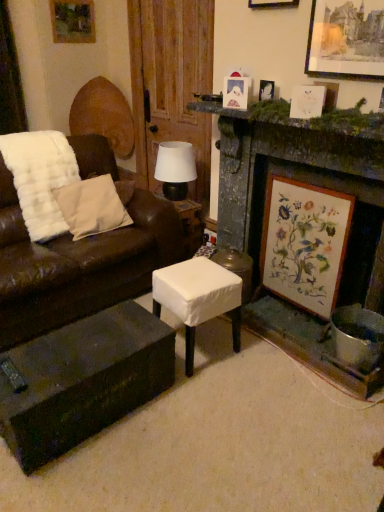
In order to face wooden framed botanical print at right, which is the 6th picture frame from top to bottom, should I rotate leftwards or rightwards?

You should rotate right by 13.926 degrees.

Locate an element on the screen. The height and width of the screenshot is (512, 384). wooden framed botanical print at right, marked as the fifth picture frame in a left-to-right arrangement is located at coordinates (304, 243).

Is white paper picture frame at upper right, which appears as the second picture frame when viewed from the front, not close to wooden picture frame at upper center, the 3th picture frame in the left-to-right sequence?

No, white paper picture frame at upper right, which appears as the second picture frame when viewed from the front, is not far away from wooden picture frame at upper center, the 3th picture frame in the left-to-right sequence.

Consider the image. From a real-world perspective, which object rests below the other?

white paper picture frame at upper right, which appears as the second picture frame when ordered from the bottom.

Is wooden picture frame at upper center, marked as the 4th picture frame in a right-to-left arrangement, completely or partially inside white paper picture frame at upper right, which appears as the second picture frame when viewed from the front?

No.

Could you measure the distance between white paper picture frame at upper right, which appears as the second picture frame when ordered from the bottom, and wooden picture frame at upper center, the 3th picture frame in the left-to-right sequence?

white paper picture frame at upper right, which appears as the second picture frame when ordered from the bottom, is 21.72 inches from wooden picture frame at upper center, the 3th picture frame in the left-to-right sequence.

From a real-world perspective, is wooden framed botanical print at right, which is the 6th picture frame from top to bottom, positioned above or below matte black table lamp at center?

wooden framed botanical print at right, which is the 6th picture frame from top to bottom, is situated lower than matte black table lamp at center in the real world.

Consider the image. Can you confirm if wooden framed botanical print at right, which is the 6th picture frame from top to bottom, is shorter than matte black table lamp at center?

No.

From the matte black table lamp at center, count 2nd picture frames forward and point to it. Please provide its 2D coordinates.

[(304, 243)]

Is matte black table lamp at center bigger or smaller than stone fireplace at center right?

Clearly, matte black table lamp at center is smaller in size than stone fireplace at center right.

Is matte black table lamp at center oriented towards stone fireplace at center right?

Yes, matte black table lamp at center is turned towards stone fireplace at center right.

Between matte black table lamp at center and stone fireplace at center right, which one appears on the left side from the viewer's perspective?

Positioned to the left is matte black table lamp at center.

Do you think white fabric-covered stool at center is within wooden picture frame at upper right, the 3th picture frame from the top, or outside of it?

The correct answer is: outside.

Could you measure the distance between white fabric-covered stool at center and wooden picture frame at upper right, which is the 1th picture frame from front to back?

white fabric-covered stool at center and wooden picture frame at upper right, which is the 1th picture frame from front to back, are 4.35 feet apart from each other.

In the scene shown: What's the angular difference between white fabric-covered stool at center and wooden picture frame at upper right, the 3th picture frame from the top,'s facing directions?

The angular difference between white fabric-covered stool at center and wooden picture frame at upper right, the 3th picture frame from the top, is 4.19 degrees.

Are white fabric-covered stool at center and wooden picture frame at upper right, the 3th picture frame from the top, beside each other?

white fabric-covered stool at center is not next to wooden picture frame at upper right, the 3th picture frame from the top, and they're not touching.

From the picture: Is white fabric-covered stool at center facing towards white paper picture frame at upper right, which is counted as the fifth picture frame, starting from the back?

No, white fabric-covered stool at center is not aimed at white paper picture frame at upper right, which is counted as the fifth picture frame, starting from the back.

How different are the orientations of white fabric-covered stool at center and white paper picture frame at upper right, which is counted as the fifth picture frame, starting from the back, in degrees?

The angular difference between white fabric-covered stool at center and white paper picture frame at upper right, which is counted as the fifth picture frame, starting from the back, is 3.58 degrees.

From the image's perspective, which object appears higher, white fabric-covered stool at center or white paper picture frame at upper right, which is counted as the fifth picture frame, starting from the top?

From the image's view, white paper picture frame at upper right, which is counted as the fifth picture frame, starting from the top, is above.

Is point (217, 309) farther from viewer compared to point (298, 100)?

Yes, it is behind point (298, 100).

Which object is wider, wooden picture frame at upper left, arranged as the 6th picture frame when viewed from the front, or dark wood coffee table at lower center?

dark wood coffee table at lower center.

Can you confirm if wooden picture frame at upper left, arranged as the 6th picture frame when viewed from the front, is shorter than dark wood coffee table at lower center?

No.

Is dark wood coffee table at lower center at the back of wooden picture frame at upper left, which is the sixth picture frame in bottom-to-top order?

No, wooden picture frame at upper left, which is the sixth picture frame in bottom-to-top order,'s orientation is not away from dark wood coffee table at lower center.

From the image's perspective, which is below, wooden picture frame at upper left, arranged as the 6th picture frame when viewed from the front, or dark wood coffee table at lower center?

dark wood coffee table at lower center appears lower in the image.

From the image's perspective, which is above, wooden framed botanical print at right, the 2th picture frame viewed from the right, or brown leather couch at left?

brown leather couch at left is shown above in the image.

Is wooden framed botanical print at right, the third picture frame when ordered from back to front, at the left side of brown leather couch at left?

No, wooden framed botanical print at right, the third picture frame when ordered from back to front, is not to the left of brown leather couch at left.

Locate an element on the screen. The width and height of the screenshot is (384, 512). picture frame below the brown leather couch at left (from a real-world perspective) is located at coordinates (304, 243).

From the image's perspective, which picture frame is the 3rd one below the wooden picture frame at upper center, which appears as the second picture frame when viewed from the top? Please provide its 2D coordinates.

[(307, 101)]

This screenshot has height=512, width=384. I want to click on table lamp above the wooden framed botanical print at right, the 4th picture frame in the front-to-back sequence (from the image's perspective), so click(175, 169).

When comparing their distances from white paper picture frame at upper right, arranged as the fourth picture frame when viewed from the left, does beige cotton pillow at left or wooden picture frame at upper center, marked as the 4th picture frame in a right-to-left arrangement, seem closer?

wooden picture frame at upper center, marked as the 4th picture frame in a right-to-left arrangement, is positioned closer to the anchor white paper picture frame at upper right, arranged as the fourth picture frame when viewed from the left.

Looking at the image, which one is located closer to brown leather couch at left, white paper picture frame at upper right, which appears as the second picture frame when viewed from the front, or dark wood coffee table at lower center?

dark wood coffee table at lower center is positioned closer to the anchor brown leather couch at left.

Estimate the real-world distances between objects in this image. Which object is further from wooden picture frame at upper right, the fourth picture frame when ordered from bottom to top, white fabric stool at center or wooden picture frame at upper left, placed as the 1th picture frame when sorted from top to bottom?

wooden picture frame at upper left, placed as the 1th picture frame when sorted from top to bottom, lies further to wooden picture frame at upper right, the fourth picture frame when ordered from bottom to top, than the other object.

Estimate the real-world distances between objects in this image. Which object is further from wooden framed botanical print at right, the third picture frame when ordered from back to front, white fabric stool at center or matte black table lamp at center?

The object further to wooden framed botanical print at right, the third picture frame when ordered from back to front, is matte black table lamp at center.

When comparing their distances from white fabric stool at center, does wooden picture frame at upper right, the fourth picture frame when ordered from bottom to top, or wooden picture frame at upper left, arranged as the 6th picture frame when viewed from the front, seem further?

wooden picture frame at upper left, arranged as the 6th picture frame when viewed from the front, lies further to white fabric stool at center than the other object.

Based on their spatial positions, is wooden picture frame at upper right, the 3th picture frame from the top, or matte black table lamp at center closer to dark wood coffee table at lower center?

matte black table lamp at center lies closer to dark wood coffee table at lower center than the other object.

Based on their spatial positions, is white fabric-covered stool at center or wooden picture frame at upper left, positioned as the first picture frame in back-to-front order, further from wooden picture frame at upper right, the sixth picture frame positioned from the back?

wooden picture frame at upper left, positioned as the first picture frame in back-to-front order, lies further to wooden picture frame at upper right, the sixth picture frame positioned from the back, than the other object.

Which object lies further to the anchor point dark wood coffee table at lower center, white paper picture frame at upper center, arranged as the 2th picture frame when viewed from the left, or wooden picture frame at upper right, which is the 1th picture frame from front to back?

wooden picture frame at upper right, which is the 1th picture frame from front to back, lies further to dark wood coffee table at lower center than the other object.

You are a GUI agent. You are given a task and a screenshot of the screen. Output one action in this format:
    pyautogui.click(x=<x>, y=<y>)
    Task: Click on the table lamp between wooden picture frame at upper right, which is the 1th picture frame from front to back, and white fabric stool at center vertically
    
    Given the screenshot: What is the action you would take?
    pyautogui.click(x=175, y=169)

I want to click on studio couch between wooden picture frame at upper left, arranged as the 6th picture frame when viewed from the front, and white fabric stool at center in the up-down direction, so click(x=78, y=265).

Locate an element on the screen. This screenshot has height=512, width=384. table lamp located between wooden picture frame at upper left, positioned as the first picture frame in back-to-front order, and wooden picture frame at upper right, which is the 1th picture frame from front to back, in the left-right direction is located at coordinates (175, 169).

I want to click on stool between dark wood coffee table at lower center and matte black table lamp at center along the z-axis, so [236, 267].